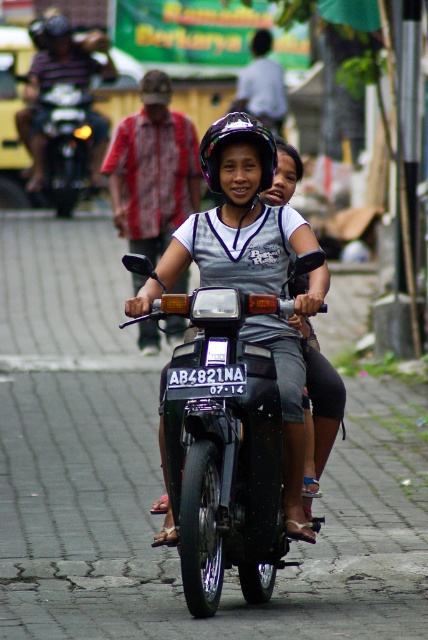
Which of these two, black glossy motorcycle at center or matte black helmet at center, stands shorter?

With less height is black glossy motorcycle at center.

Can you confirm if black glossy motorcycle at center is positioned to the left of matte black helmet at center?

No, black glossy motorcycle at center is not to the left of matte black helmet at center.

The height and width of the screenshot is (640, 428). I want to click on black glossy motorcycle at center, so click(223, 448).

Between black glossy motorcycle at center and shiny black motorcycle at left, which one appears on the left side from the viewer's perspective?

shiny black motorcycle at left

Between black glossy motorcycle at center and shiny black motorcycle at left, which one appears on the right side from the viewer's perspective?

From the viewer's perspective, black glossy motorcycle at center appears more on the right side.

Between point (240, 566) and point (51, 102), which one is positioned in front?

Positioned in front is point (240, 566).

Identify the location of black glossy motorcycle at center. (223, 448).

Does point (67, 45) come farther from viewer compared to point (261, 154)?

Yes, point (67, 45) is behind point (261, 154).

In the scene shown: Can you confirm if matte black helmet at upper center is taller than matte black helmet at center?

No.

Does point (89, 51) lie in front of point (214, 168)?

No, it is behind (214, 168).

Where is `matte black helmet at upper center`? matte black helmet at upper center is located at coordinates (59, 76).